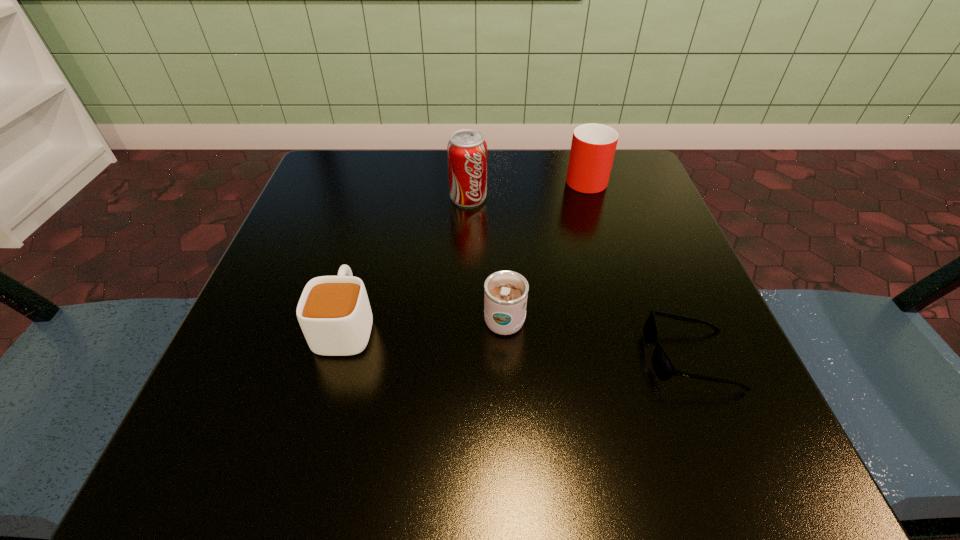
Identify the location of free location located 0.260m on the side with the handle of the leftmost cup. (380, 201).

Where is `blank space located on the side with the handle of the leftmost cup`? This screenshot has height=540, width=960. blank space located on the side with the handle of the leftmost cup is located at coordinates (366, 256).

The image size is (960, 540). I want to click on free space located 0.340m on the side with the handle of the leftmost cup, so coord(386,179).

Image resolution: width=960 pixels, height=540 pixels. What are the coordinates of `vacant region located on the front-facing side of the sunglasses` in the screenshot? It's located at (522, 358).

Locate an element on the screen. This screenshot has width=960, height=540. vacant space situated on the front-facing side of the sunglasses is located at coordinates (578, 358).

Find the location of `vacant position located 0.130m on the front-facing side of the sunglasses`. vacant position located 0.130m on the front-facing side of the sunglasses is located at coordinates (557, 358).

You are a GUI agent. You are given a task and a screenshot of the screen. Output one action in this format:
    pyautogui.click(x=<x>, y=<y>)
    Task: Click on the soda can that is positioned at the far edge
    The width and height of the screenshot is (960, 540).
    Given the screenshot: What is the action you would take?
    pyautogui.click(x=467, y=150)

Find the location of `cup at the far edge`. cup at the far edge is located at coordinates (593, 147).

Identify the location of object located at the left edge. This screenshot has height=540, width=960. (334, 313).

This screenshot has height=540, width=960. Find the location of `cup present at the right edge`. cup present at the right edge is located at coordinates (593, 147).